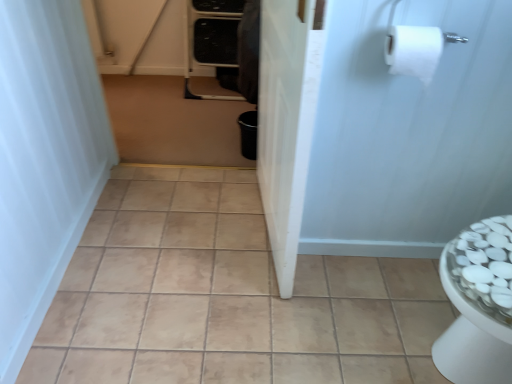
I want to click on vacant space in front of white matte screen door at upper right, which ranks as the 2th screen door in left-to-right order, so click(389, 307).